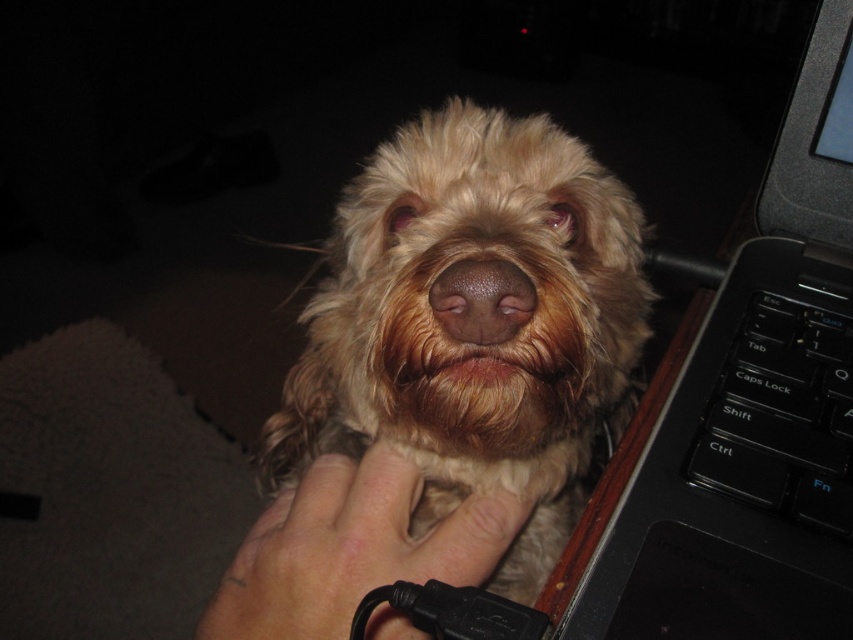
You are trying to reach the black plastic laptop at right while your hand is currently touching the light skin hand at center. Can you reach it without moving your hand?

The black plastic laptop at right is to the right of the light skin hand at center, so you can reach it without moving your hand by extending your arm to the right side.

Based on the photo, you are trying to place a new monitor stand that requires 10 cm of vertical space between the black plastic laptop at right and the light skin hand at center. Based on the scene description, will there be enough space?

The black plastic laptop at right is much taller than the light skin hand at center, so there should be sufficient vertical space for the monitor stand between them.